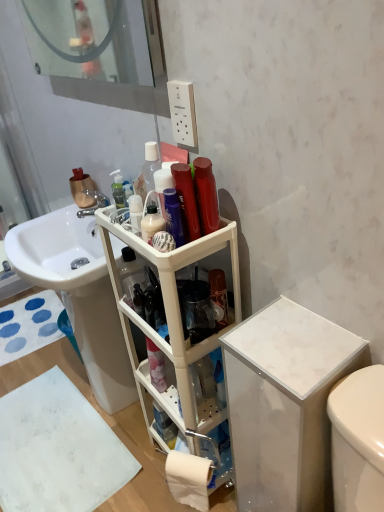
Question: Considering the relative sizes of metallic silver faucet at sink left and translucent plastic pump bottle at upper center, which ranks as the 3th toiletry in bottom-to-top order, in the image provided, is metallic silver faucet at sink left taller than translucent plastic pump bottle at upper center, which ranks as the 3th toiletry in bottom-to-top order,?

Choices:
 (A) no
 (B) yes

Answer: (B)

Question: Is metallic silver faucet at sink left located outside translucent plastic pump bottle at upper center, the 3th toiletry viewed from the front?

Choices:
 (A) no
 (B) yes

Answer: (B)

Question: Is metallic silver faucet at sink left at the right side of translucent plastic pump bottle at upper center, the 2th toiletry when ordered from back to front?

Choices:
 (A) no
 (B) yes

Answer: (A)

Question: Is metallic silver faucet at sink left positioned with its back to translucent plastic pump bottle at upper center, the 2th toiletry when ordered from back to front?

Choices:
 (A) no
 (B) yes

Answer: (A)

Question: Considering the relative sizes of metallic silver faucet at sink left and translucent plastic pump bottle at upper center, the 2th toiletry when ordered from back to front, in the image provided, is metallic silver faucet at sink left shorter than translucent plastic pump bottle at upper center, the 2th toiletry when ordered from back to front,?

Choices:
 (A) yes
 (B) no

Answer: (B)

Question: From the image's perspective, is metallic silver faucet at sink left located beneath translucent plastic pump bottle at upper center, the 3th toiletry viewed from the front?

Choices:
 (A) yes
 (B) no

Answer: (B)

Question: Is white matte bath mat at lower left, arranged as the 1th bath mat when ordered from the bottom, a part of clear glass mirror at upper left?

Choices:
 (A) no
 (B) yes

Answer: (A)

Question: Is the depth of clear glass mirror at upper left greater than that of white matte bath mat at lower left, marked as the 2th bath mat in a top-to-bottom arrangement?

Choices:
 (A) yes
 (B) no

Answer: (B)

Question: Can you confirm if clear glass mirror at upper left is wider than white matte bath mat at lower left, which ranks as the first bath mat in front-to-back order?

Choices:
 (A) yes
 (B) no

Answer: (B)

Question: Is clear glass mirror at upper left not within white matte bath mat at lower left, which ranks as the first bath mat in front-to-back order?

Choices:
 (A) no
 (B) yes

Answer: (B)

Question: Does clear glass mirror at upper left have a greater height compared to white matte bath mat at lower left, which ranks as the first bath mat in front-to-back order?

Choices:
 (A) yes
 (B) no

Answer: (A)

Question: Is the surface of clear glass mirror at upper left in direct contact with white matte bath mat at lower left, marked as the 2th bath mat in a top-to-bottom arrangement?

Choices:
 (A) yes
 (B) no

Answer: (B)

Question: From a real-world perspective, is pink matte spray can at center, arranged as the 1th toiletry when ordered from the bottom, physically below white glossy sink at center?

Choices:
 (A) yes
 (B) no

Answer: (B)